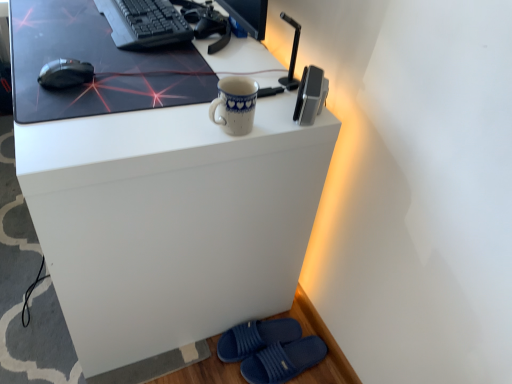
Where is `free space to the left of blue porcelain mug at upper center`? free space to the left of blue porcelain mug at upper center is located at coordinates (154, 124).